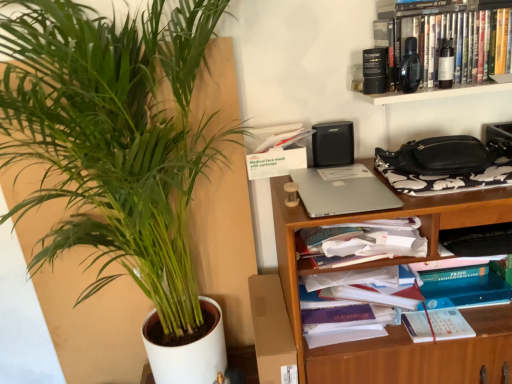
Question: Does green leafy plant at left have a greater width compared to silver metallic laptop at center-right?

Choices:
 (A) yes
 (B) no

Answer: (B)

Question: Is green leafy plant at left facing away from silver metallic laptop at center-right?

Choices:
 (A) yes
 (B) no

Answer: (B)

Question: Does green leafy plant at left have a lesser height compared to silver metallic laptop at center-right?

Choices:
 (A) yes
 (B) no

Answer: (B)

Question: Is green leafy plant at left to the left of silver metallic laptop at center-right from the viewer's perspective?

Choices:
 (A) yes
 (B) no

Answer: (A)

Question: Can you confirm if green leafy plant at left is smaller than silver metallic laptop at center-right?

Choices:
 (A) no
 (B) yes

Answer: (A)

Question: Is green leafy plant at left closer to the viewer compared to silver metallic laptop at center-right?

Choices:
 (A) no
 (B) yes

Answer: (A)

Question: Can you confirm if silver metallic laptop at center-right is thinner than black plastic shelf at upper right, acting as the 1th shelf starting from the top?

Choices:
 (A) no
 (B) yes

Answer: (A)

Question: Is silver metallic laptop at center-right closer to the viewer compared to black plastic shelf at upper right, acting as the 1th shelf starting from the top?

Choices:
 (A) yes
 (B) no

Answer: (A)

Question: Is silver metallic laptop at center-right wider than black plastic shelf at upper right, acting as the 1th shelf starting from the top?

Choices:
 (A) yes
 (B) no

Answer: (A)

Question: Are silver metallic laptop at center-right and black plastic shelf at upper right, acting as the 1th shelf starting from the top, located far from each other?

Choices:
 (A) no
 (B) yes

Answer: (A)

Question: From the image's perspective, is silver metallic laptop at center-right below black plastic shelf at upper right, acting as the 1th shelf starting from the top?

Choices:
 (A) no
 (B) yes

Answer: (B)

Question: Is silver metallic laptop at center-right smaller than black plastic shelf at upper right, placed as the second shelf when sorted from bottom to top?

Choices:
 (A) no
 (B) yes

Answer: (B)

Question: Considering the relative sizes of green leafy plant at left and black plastic shelf at upper right, acting as the 1th shelf starting from the top, in the image provided, is green leafy plant at left taller than black plastic shelf at upper right, acting as the 1th shelf starting from the top,?

Choices:
 (A) yes
 (B) no

Answer: (A)